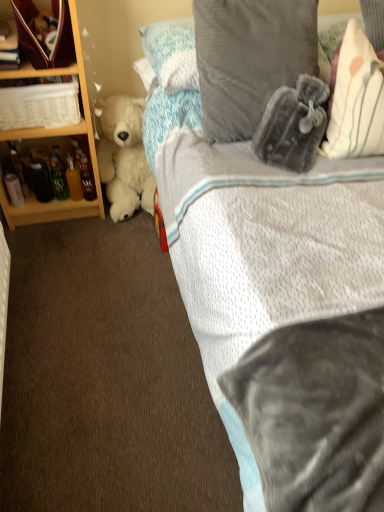
Question: Looking at their shapes, would you say white plastic basket at left is wider or thinner than velvety gray pillow at upper right?

Choices:
 (A) wide
 (B) thin

Answer: (B)

Question: Visually, is white plastic basket at left positioned to the left or to the right of velvety gray pillow at upper right?

Choices:
 (A) right
 (B) left

Answer: (B)

Question: Which object is the closest to the wooden bookcase at left?

Choices:
 (A) white plastic basket at left
 (B) velvet maroon bag at upper left
 (C) matte glass bottle at left
 (D) velvety gray pillow at upper right
 (E) white soft pillow at upper right, placed as the first pillow when sorted from right to left

Answer: (A)

Question: Estimate the real-world distances between objects in this image. Which object is farther from the velvet maroon bag at upper left?

Choices:
 (A) white plush teddy bear at left
 (B) wooden bookcase at left
 (C) velvety gray pillow at upper right, which appears as the first pillow when viewed from the left
 (D) matte glass bottle at left
 (E) white soft pillow at upper right, arranged as the 2th pillow when viewed from the left

Answer: (E)